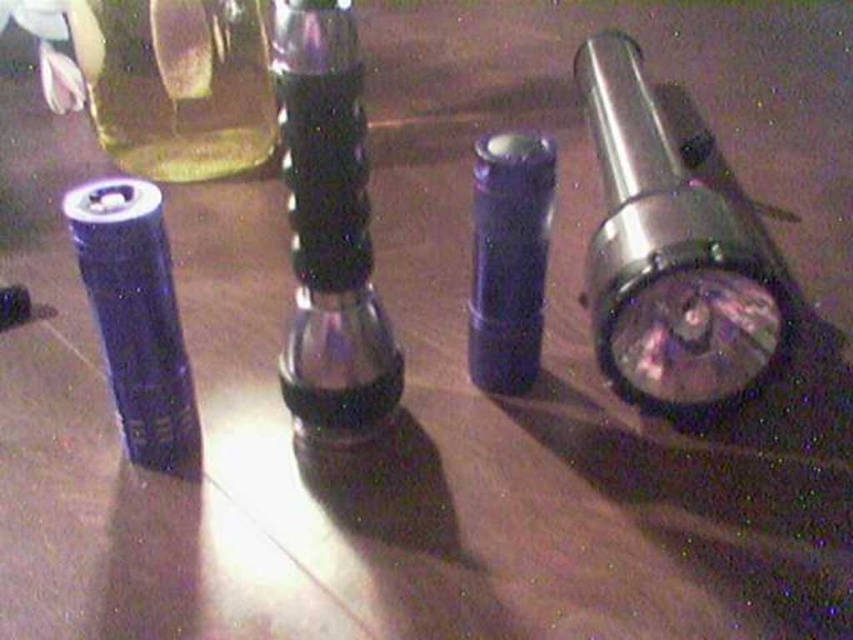
Based on the photo, you are standing at the center of the image and want to reach the metallic silver flashlight at right. Which direction should you move to get closer to it?

You should move to the right because the metallic silver flashlight at right is located to the right of the center.

You are organizing a makeup kit and have both the transparent plastic bottle at center and the matte purple lipstick at center. Which item should you place in the larger compartment to accommodate its size?

The transparent plastic bottle at center is larger in size than the matte purple lipstick at center, so you should place the transparent plastic bottle at center in the larger compartment.

You are holding a metallic silver flashlight at right and want to hand it to someone standing near the camera. Can you reach them without moving your feet?

The metallic silver flashlight at right and camera are 26.98 inches apart from each other. Since the average human arm length is about 25 inches, you might not be able to reach them without moving your feet.